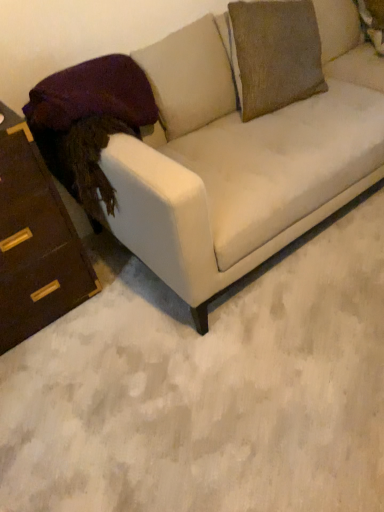
At what (x,y) coordinates should I click in order to perform the action: click on spots to the right of brown wood chest of drawers at left. Please return your answer as a coordinate pair (x, y). Image resolution: width=384 pixels, height=512 pixels. Looking at the image, I should click on (124, 297).